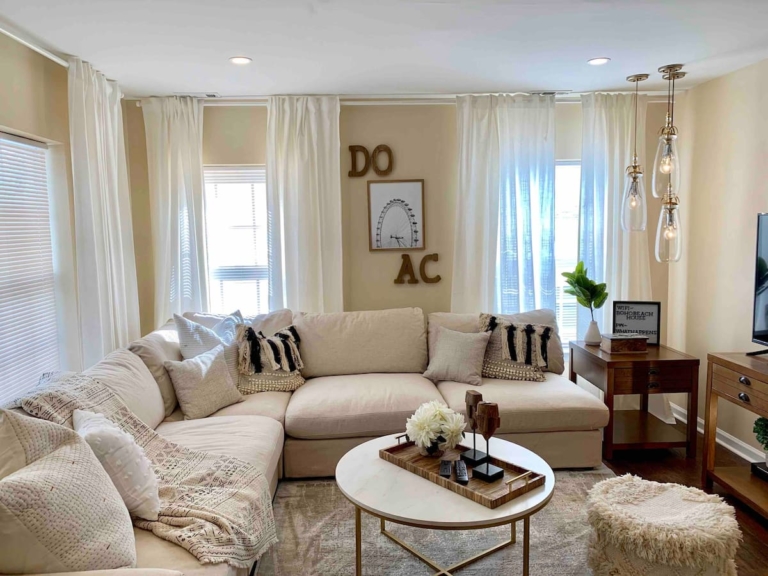
This screenshot has width=768, height=576. Find the location of `wall`. wall is located at coordinates (425, 138), (252, 141), (35, 94), (727, 161), (650, 120), (136, 161).